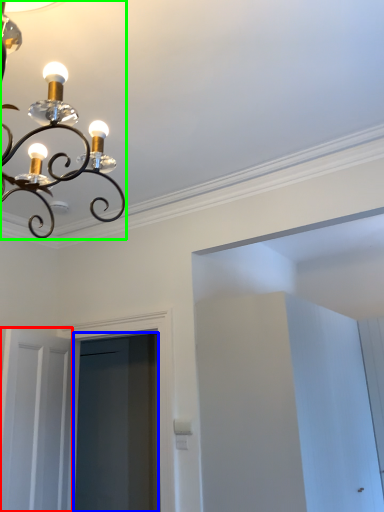
Question: Considering the real-world distances, which object is closest to door (highlighted by a red box)? screen door (highlighted by a blue box) or lamp (highlighted by a green box).

Choices:
 (A) screen door
 (B) lamp

Answer: (A)